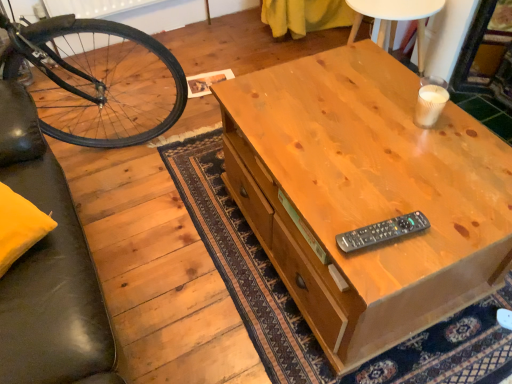
Question: Considering the positions of point click(x=419, y=225) and point click(x=352, y=147), is point click(x=419, y=225) closer or farther from the camera than point click(x=352, y=147)?

Choices:
 (A) farther
 (B) closer

Answer: (B)

Question: Is black plastic remote at center taller or shorter than light brown wood desk at center?

Choices:
 (A) tall
 (B) short

Answer: (B)

Question: Considering the real-world distances, which object is farthest from the light brown wood desk at center?

Choices:
 (A) black plastic remote at center
 (B) white paper cup at upper right

Answer: (B)

Question: Based on their relative distances, which object is farther from the black plastic remote at center?

Choices:
 (A) light brown wood desk at center
 (B) white paper cup at upper right

Answer: (B)